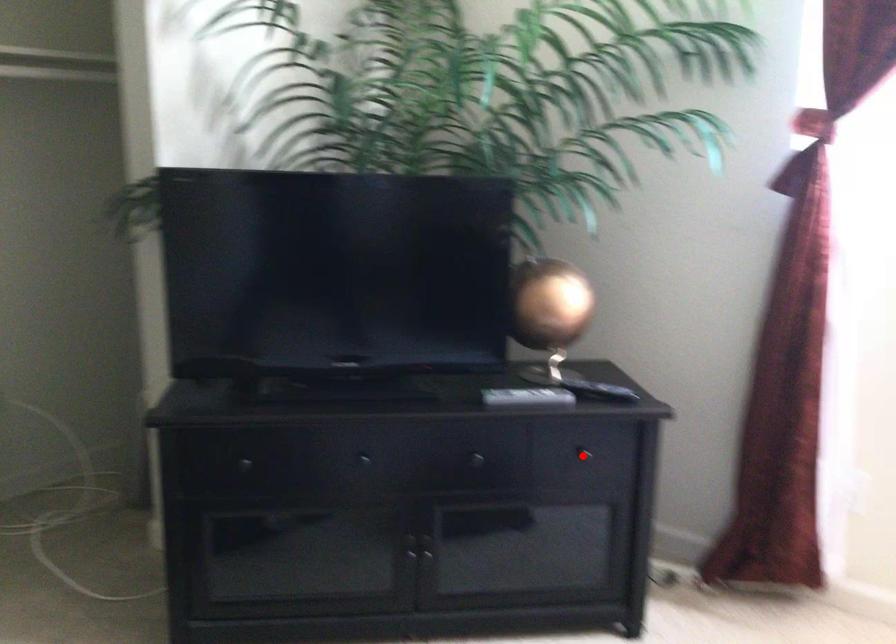
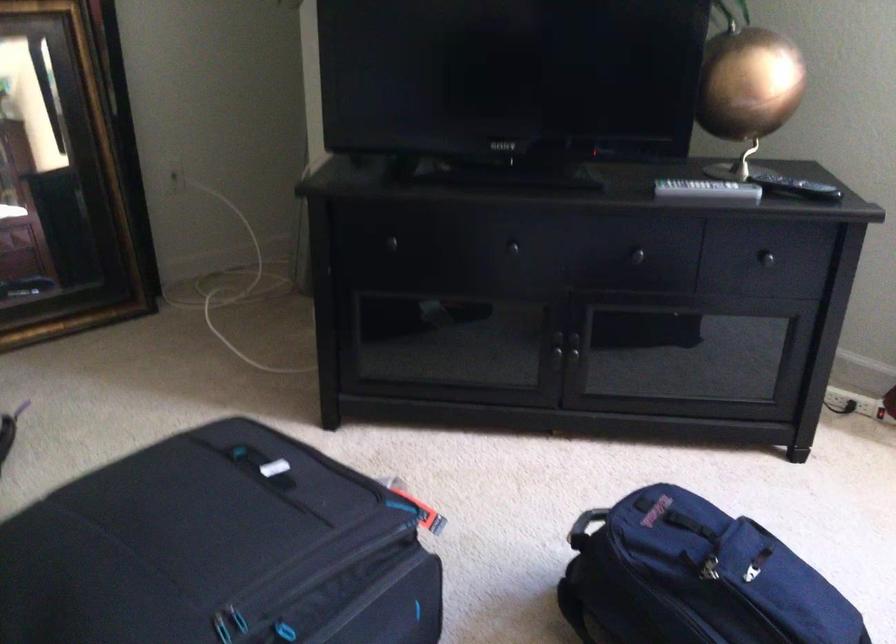
Locate, in the second image, the point that corresponds to the highlighted location in the first image.

(760, 260)